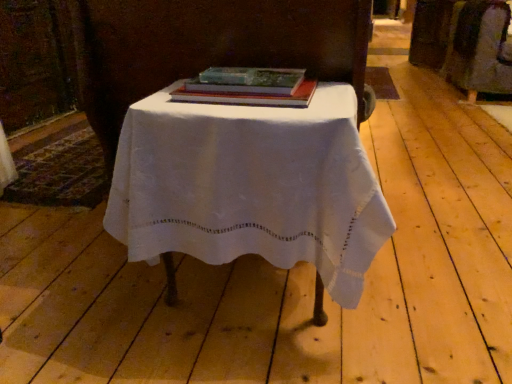
Find the location of a particular element. vacant space underneath white cloth-covered table at center (from a real-world perspective) is located at coordinates (242, 296).